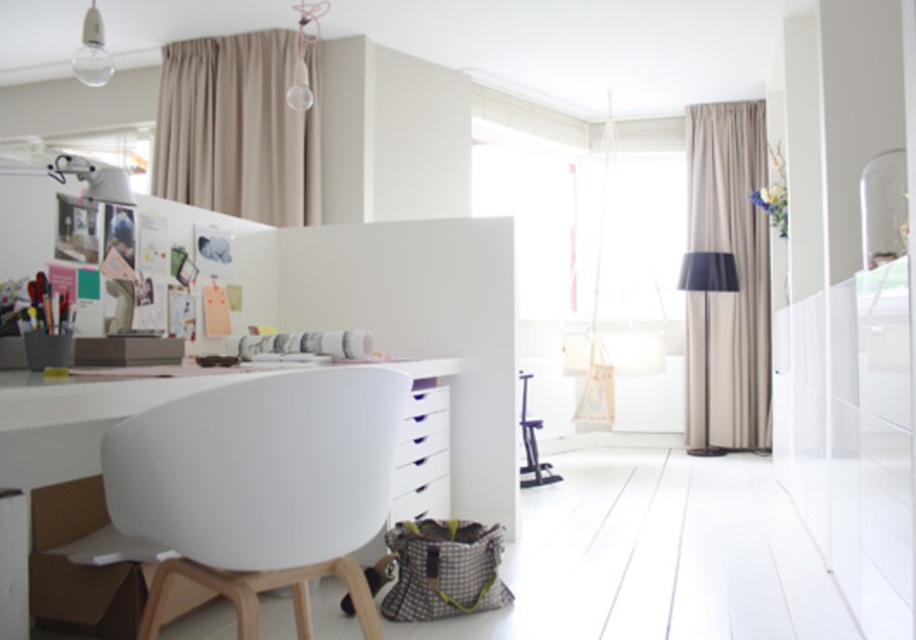
Question: Can you confirm if beige fabric curtain at right is positioned above black fabric lamp at right?

Choices:
 (A) no
 (B) yes

Answer: (B)

Question: Which object appears closest to the camera in this image?

Choices:
 (A) matte white lampshade at upper left
 (B) clear glass bulb at upper left
 (C) black fabric lamp at right
 (D) white plastic chair at center

Answer: (D)

Question: Observing the image, what is the correct spatial positioning of white plastic chair at center in reference to metallic stool at center?

Choices:
 (A) right
 (B) left

Answer: (B)

Question: Is white glossy drawer at center positioned at the back of black fabric lamp at right?

Choices:
 (A) no
 (B) yes

Answer: (A)

Question: Which object is closer to the camera taking this photo?

Choices:
 (A) clear glass bulb at upper left
 (B) white glossy drawer at center
 (C) white plastic chair at center

Answer: (C)

Question: Among these points, which one is nearest to the camera?

Choices:
 (A) (83, 60)
 (B) (104, 193)
 (C) (684, 273)
 (D) (760, 340)

Answer: (B)